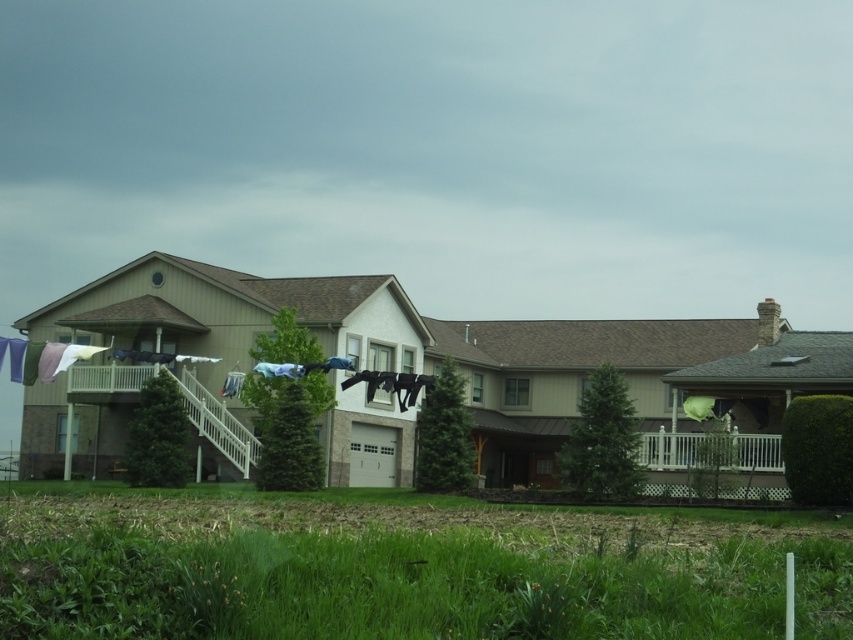
Question: Is green grass at lower center below white wooden porch at right?

Choices:
 (A) no
 (B) yes

Answer: (B)

Question: Can you confirm if green grass at lower center is bigger than white wooden porch at right?

Choices:
 (A) no
 (B) yes

Answer: (B)

Question: Which object is farther from the camera taking this photo?

Choices:
 (A) white wooden porch at right
 (B) green grass at lower center

Answer: (A)

Question: Does green grass at lower center appear on the right side of white wooden porch at right?

Choices:
 (A) no
 (B) yes

Answer: (A)

Question: Which point appears closest to the camera in this image?

Choices:
 (A) (408, 516)
 (B) (672, 435)

Answer: (A)